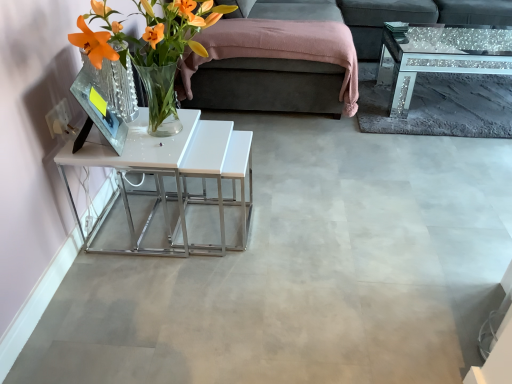
Identify the location of vacant space to the right of white glossy table at left. (291, 221).